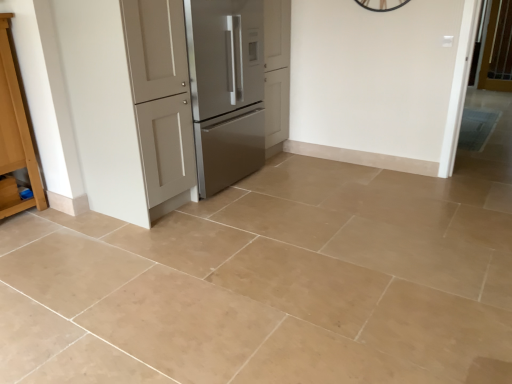
Question: Is matte white door at center oriented away from light brown wood cabinet at left?

Choices:
 (A) yes
 (B) no

Answer: (B)

Question: Does matte white door at center have a lesser height compared to light brown wood cabinet at left?

Choices:
 (A) yes
 (B) no

Answer: (B)

Question: Is matte white door at center at the right side of light brown wood cabinet at left?

Choices:
 (A) yes
 (B) no

Answer: (A)

Question: Is matte white door at center with light brown wood cabinet at left?

Choices:
 (A) no
 (B) yes

Answer: (A)

Question: Is light brown wood cabinet at left surrounded by matte white door at center?

Choices:
 (A) yes
 (B) no

Answer: (B)

Question: From a real-world perspective, is matte white door at center over light brown wood cabinet at left?

Choices:
 (A) yes
 (B) no

Answer: (A)

Question: Is the position of matte white door at center less distant than that of satin silver refrigerator at center-left?

Choices:
 (A) no
 (B) yes

Answer: (B)

Question: From a real-world perspective, is matte white door at center beneath satin silver refrigerator at center-left?

Choices:
 (A) yes
 (B) no

Answer: (B)

Question: Could you tell me if matte white door at center is turned towards satin silver refrigerator at center-left?

Choices:
 (A) no
 (B) yes

Answer: (B)

Question: Can satin silver refrigerator at center-left be found inside matte white door at center?

Choices:
 (A) no
 (B) yes

Answer: (B)

Question: Is matte white door at center smaller than satin silver refrigerator at center-left?

Choices:
 (A) yes
 (B) no

Answer: (B)

Question: Considering the relative sizes of matte white door at center and satin silver refrigerator at center-left in the image provided, is matte white door at center bigger than satin silver refrigerator at center-left?

Choices:
 (A) yes
 (B) no

Answer: (A)

Question: Is light brown wood cabinet at left at the right side of clear glass screen door at upper right?

Choices:
 (A) yes
 (B) no

Answer: (B)